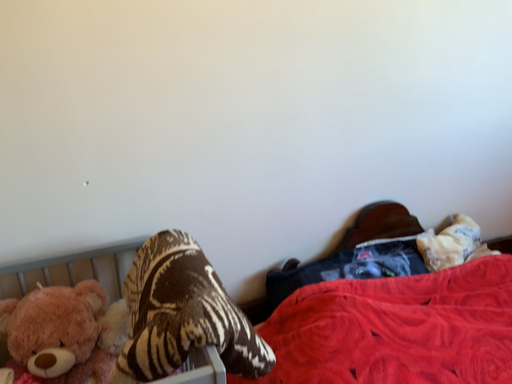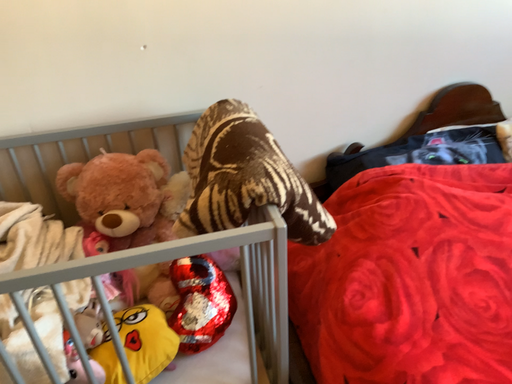
Question: How did the camera likely rotate when shooting the video?

Choices:
 (A) rotated upward
 (B) rotated downward

Answer: (B)